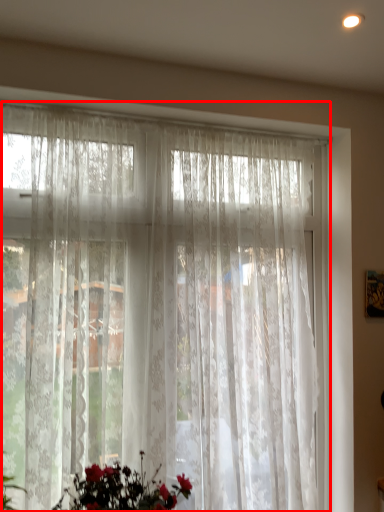
Question: From the image's perspective, what is the correct spatial relationship of curtain (annotated by the red box) in relation to floral arrangement?

Choices:
 (A) below
 (B) above

Answer: (B)